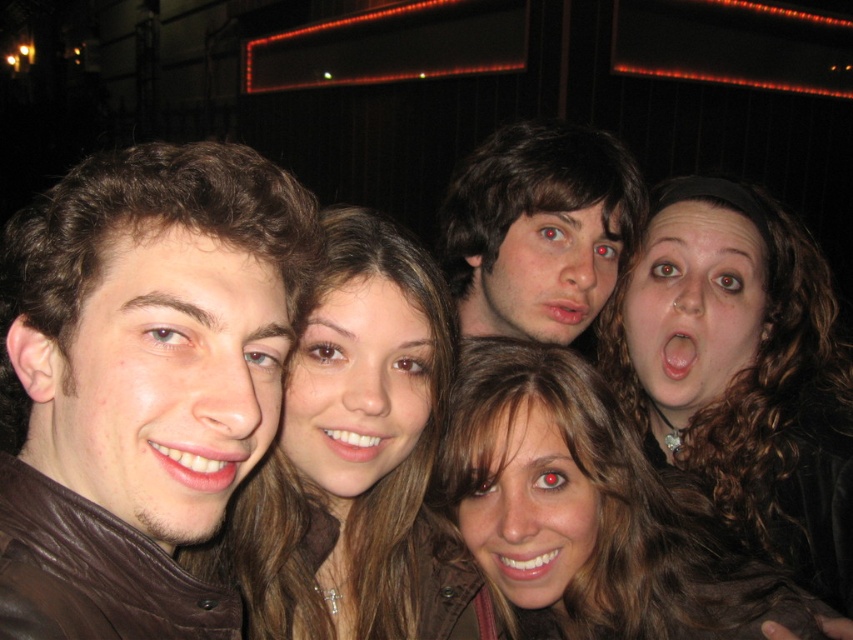
How much distance is there between white glossy teeth at center and pink matte lips at center?

34.65 inches

Does point (396, 432) lie behind point (582, 301)?

No, it is in front of (582, 301).

Find the location of a particular element. This screenshot has height=640, width=853. white glossy teeth at center is located at coordinates (357, 442).

Is smooth brown hair at center wider than matte skin face at center?

Yes.

Measure the distance from smooth brown hair at center to matte skin face at center.

smooth brown hair at center and matte skin face at center are 31.27 inches apart.

Find the location of a particular element. smooth brown hair at center is located at coordinates (357, 461).

Does smooth skin face at center appear on the left side of matte white teeth at lower left?

Incorrect, smooth skin face at center is not on the left side of matte white teeth at lower left.

Which is more to the right, smooth skin face at center or matte white teeth at lower left?

Positioned to the right is smooth skin face at center.

Describe the element at coordinates (357, 387) in the screenshot. I see `smooth skin face at center` at that location.

You are a GUI agent. You are given a task and a screenshot of the screen. Output one action in this format:
    pyautogui.click(x=<x>, y=<y>)
    Task: Click on the smooth skin face at center
    This screenshot has width=853, height=640.
    Given the screenshot: What is the action you would take?
    pyautogui.click(x=357, y=387)